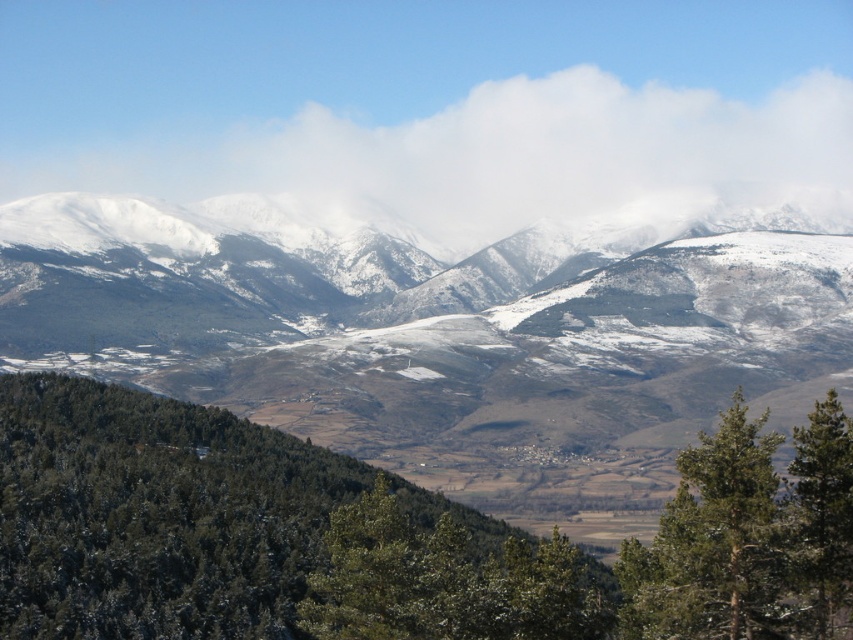
You are standing at the point labeled as point (560, 160) in the image. What object is located at this coordinate?

The point (560, 160) corresponds to a white fluffy cloud at upper center.

You are standing at the center of the image and want to hike towards the snowy rocky mountain range at center. According to the coordinates provided, is the mountain range directly in front of you or to one side?

The snowy rocky mountain range at center is located at point coordinates, so it is directly in front of you.